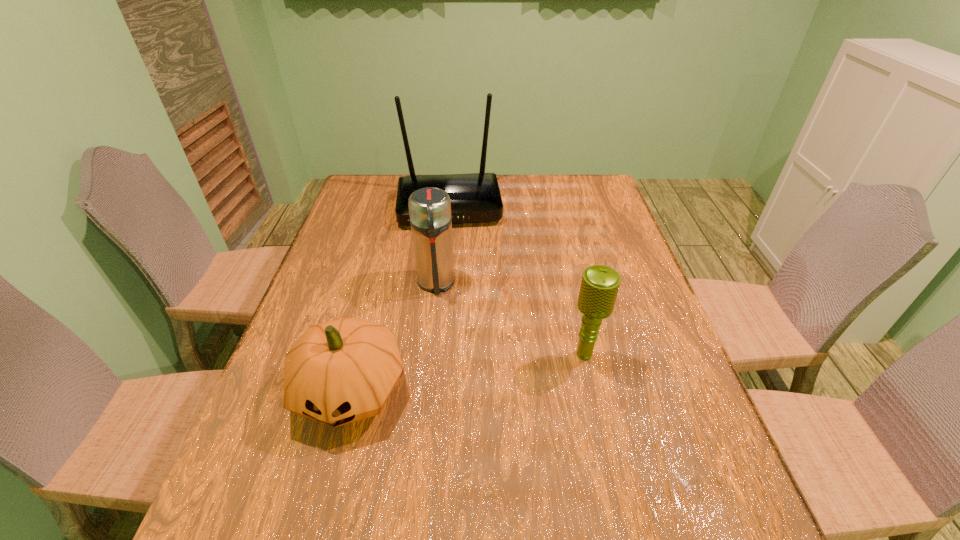
Where is `vacant area that satisfies the following two spatial constraints: 1. on the back side of the farthest object; 2. on the right side of the second farthest object`? vacant area that satisfies the following two spatial constraints: 1. on the back side of the farthest object; 2. on the right side of the second farthest object is located at coordinates (444, 206).